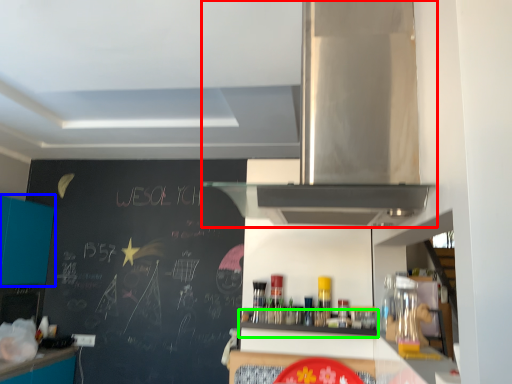
Question: Based on their relative distances, which object is farther from home appliance (highlighted by a red box)? Choose from cabinetry (highlighted by a blue box) and shelf (highlighted by a green box).

Choices:
 (A) cabinetry
 (B) shelf

Answer: (A)